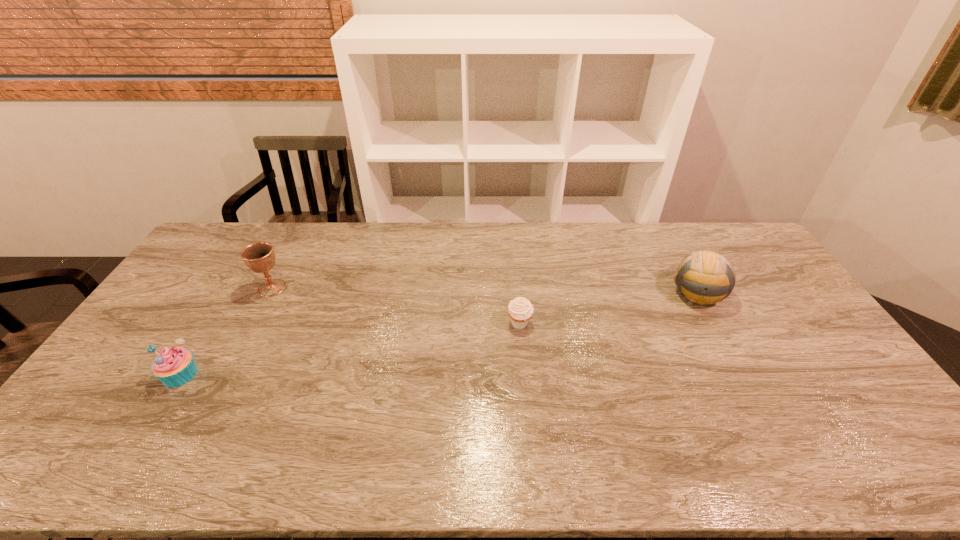
At what (x,y) coordinates should I click in order to perform the action: click on object located in the left edge section of the desktop. Please return your answer as a coordinate pair (x, y). Looking at the image, I should click on (174, 366).

In order to click on free point at the far edge in this screenshot , I will do `click(515, 240)`.

You are a GUI agent. You are given a task and a screenshot of the screen. Output one action in this format:
    pyautogui.click(x=<x>, y=<y>)
    Task: Click on the blank space at the near edge of the desktop
    The image size is (960, 540).
    Given the screenshot: What is the action you would take?
    tap(671, 470)

Where is `free space at the right edge of the desktop`? This screenshot has width=960, height=540. free space at the right edge of the desktop is located at coordinates (883, 436).

You are a GUI agent. You are given a task and a screenshot of the screen. Output one action in this format:
    pyautogui.click(x=<x>, y=<y>)
    Task: Click on the free space at the far left corner of the desktop
    
    Given the screenshot: What is the action you would take?
    (x=220, y=229)

Identify the location of vacant space at the near left corner of the desktop. The height and width of the screenshot is (540, 960). (106, 449).

Where is `blank area at the far right corner`? blank area at the far right corner is located at coordinates (736, 260).

This screenshot has width=960, height=540. I want to click on free space at the near right corner of the desktop, so click(887, 470).

What are the coordinates of `vacant space that's between the third object from left to right and the left muffin` in the screenshot? It's located at (350, 349).

This screenshot has width=960, height=540. In order to click on free space between the volleyball and the nearer muffin in this screenshot , I will do `click(439, 334)`.